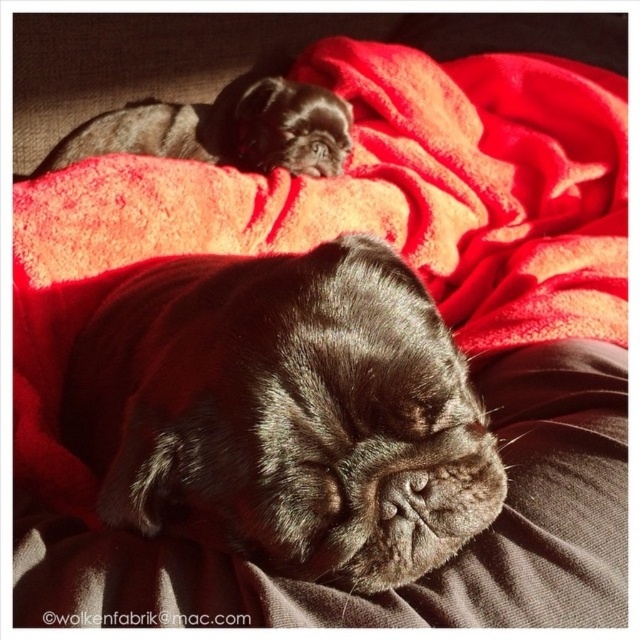
Question: Is black fur dog at center to the left of shiny black dog at upper left from the viewer's perspective?

Choices:
 (A) yes
 (B) no

Answer: (B)

Question: Which object is the closest to the shiny black dog at upper left?

Choices:
 (A) velvety red blanket at upper center
 (B) black fur dog at center

Answer: (A)

Question: Which point is farther to the camera?

Choices:
 (A) (189, 225)
 (B) (371, 387)

Answer: (A)

Question: Which object appears closest to the camera in this image?

Choices:
 (A) shiny black dog at upper left
 (B) velvety red blanket at upper center
 (C) black fur dog at center

Answer: (C)

Question: Does velvety red blanket at upper center have a smaller size compared to shiny black dog at upper left?

Choices:
 (A) no
 (B) yes

Answer: (A)

Question: In this image, where is velvety red blanket at upper center located relative to shiny black dog at upper left?

Choices:
 (A) left
 (B) right

Answer: (B)